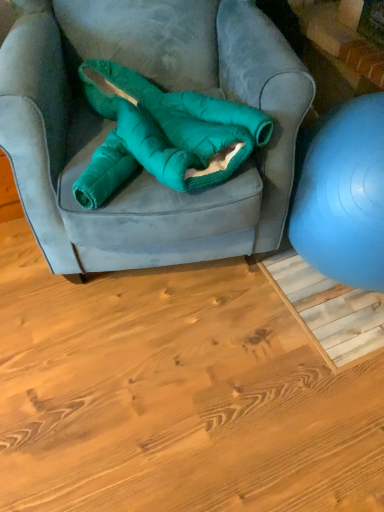
Question: Can you confirm if teal plush bean bag at center is bigger than blue rubber ball at right?

Choices:
 (A) yes
 (B) no

Answer: (B)

Question: Considering the relative positions of teal plush bean bag at center and blue rubber ball at right in the image provided, is teal plush bean bag at center to the left of blue rubber ball at right from the viewer's perspective?

Choices:
 (A) yes
 (B) no

Answer: (A)

Question: Considering the relative sizes of teal plush bean bag at center and blue rubber ball at right in the image provided, is teal plush bean bag at center taller than blue rubber ball at right?

Choices:
 (A) yes
 (B) no

Answer: (B)

Question: From a real-world perspective, does teal plush bean bag at center sit lower than blue rubber ball at right?

Choices:
 (A) no
 (B) yes

Answer: (A)

Question: Is teal plush bean bag at center looking in the opposite direction of blue rubber ball at right?

Choices:
 (A) yes
 (B) no

Answer: (B)

Question: Does teal plush bean bag at center have a greater width compared to blue rubber ball at right?

Choices:
 (A) no
 (B) yes

Answer: (A)

Question: Does blue rubber ball at right contain teal plush bean bag at center?

Choices:
 (A) no
 (B) yes

Answer: (A)

Question: Is blue rubber ball at right placed right next to teal plush bean bag at center?

Choices:
 (A) yes
 (B) no

Answer: (B)

Question: Is blue rubber ball at right aimed at teal plush bean bag at center?

Choices:
 (A) yes
 (B) no

Answer: (B)

Question: Considering the relative positions of blue rubber ball at right and teal plush bean bag at center in the image provided, is blue rubber ball at right to the left of teal plush bean bag at center from the viewer's perspective?

Choices:
 (A) yes
 (B) no

Answer: (B)

Question: From the image's perspective, does blue rubber ball at right appear higher than teal plush bean bag at center?

Choices:
 (A) yes
 (B) no

Answer: (B)

Question: From a real-world perspective, does blue rubber ball at right stand above teal plush bean bag at center?

Choices:
 (A) no
 (B) yes

Answer: (A)

Question: Is point (342, 181) closer or farther from the camera than point (157, 101)?

Choices:
 (A) closer
 (B) farther

Answer: (A)